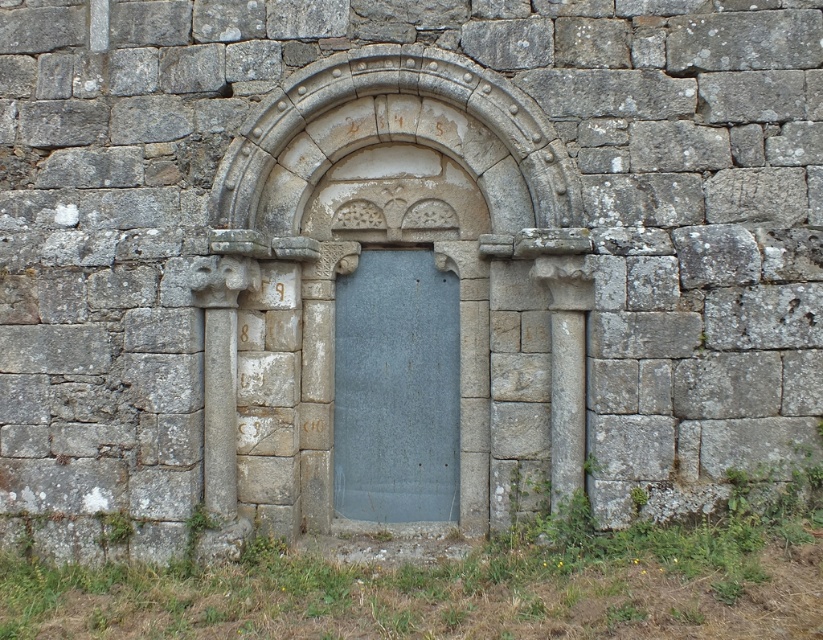
Question: Is stone archway at center positioned at the back of blue stone door at center?

Choices:
 (A) yes
 (B) no

Answer: (B)

Question: Which point is closer to the camera?

Choices:
 (A) stone archway at center
 (B) blue stone door at center

Answer: (A)

Question: Can you confirm if stone archway at center is bigger than blue stone door at center?

Choices:
 (A) no
 (B) yes

Answer: (B)

Question: Which point is farther to the camera?

Choices:
 (A) blue stone door at center
 (B) stone archway at center

Answer: (A)

Question: From the image, what is the correct spatial relationship of stone archway at center in relation to blue stone door at center?

Choices:
 (A) right
 (B) left

Answer: (A)